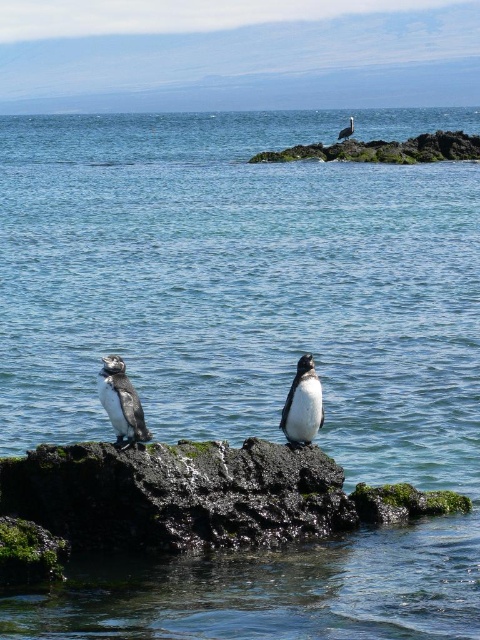
You are a photographer trying to capture both the black matte penguin at center and the white fluffy penguin at upper right in a single shot. Given that your camera has a maximum zoom range of 100 feet, can you fit both penguins into the frame without moving your position?

The black matte penguin at center is 136.17 feet away from the white fluffy penguin at upper right. Since the distance between them exceeds the camera maximum zoom range of 100 feet, you cannot fit both penguins into the frame without moving your position.

You are a photographer standing at the edge of the cliff overlooking the coastal scene. You want to capture a closeup shot of the rough rock at upper right. Given that your telephoto lens has a maximum effective range of 150 feet, will you be able to take the photo without moving closer to the rock?

The rough rock at upper right is 148.90 feet away from the camera. Since the telephoto lens can reach up to 150 feet, you can take the closeup shot without moving closer.